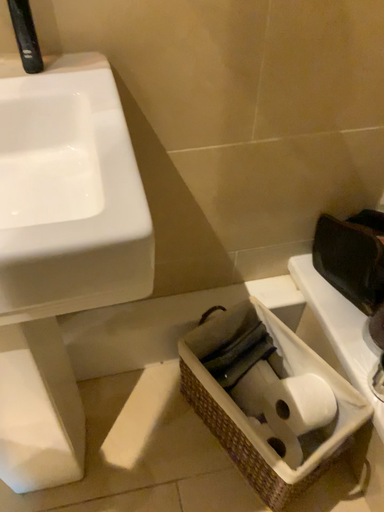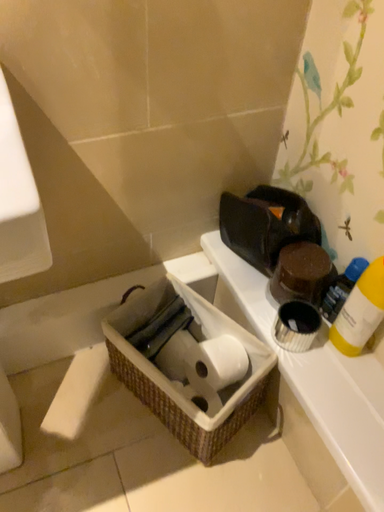
Question: Which way did the camera rotate in the video?

Choices:
 (A) rotated left
 (B) rotated right

Answer: (B)